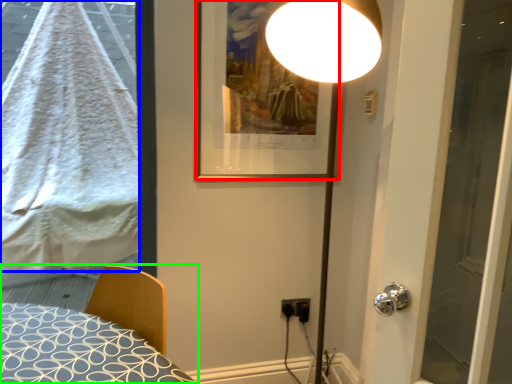
Question: Which object is positioned farthest from picture frame (highlighted by a red box)? Select from blanket (highlighted by a blue box) and bed (highlighted by a green box).

Choices:
 (A) blanket
 (B) bed

Answer: (A)